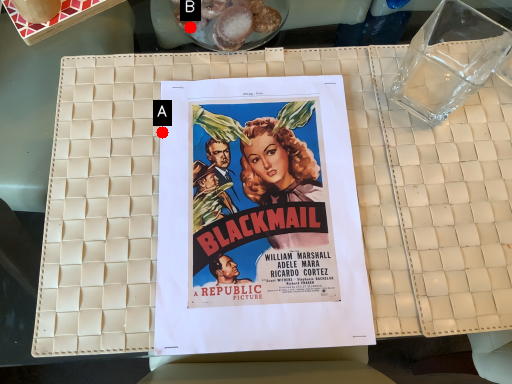
Question: Two points are circled on the image, labeled by A and B beside each circle. Which point is closer to the camera taking this photo?

Choices:
 (A) A is closer
 (B) B is closer

Answer: (A)